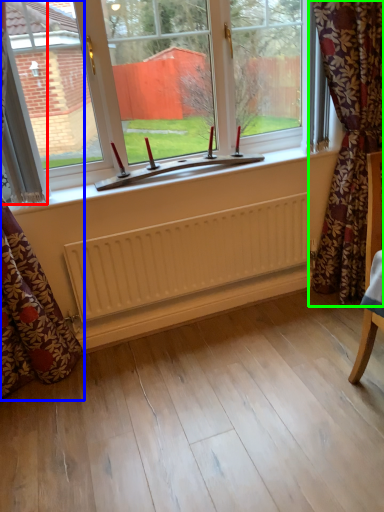
Question: Which is nearer to the curtain (highlighted by a red box)? curtain (highlighted by a blue box) or curtain (highlighted by a green box).

Choices:
 (A) curtain
 (B) curtain

Answer: (A)